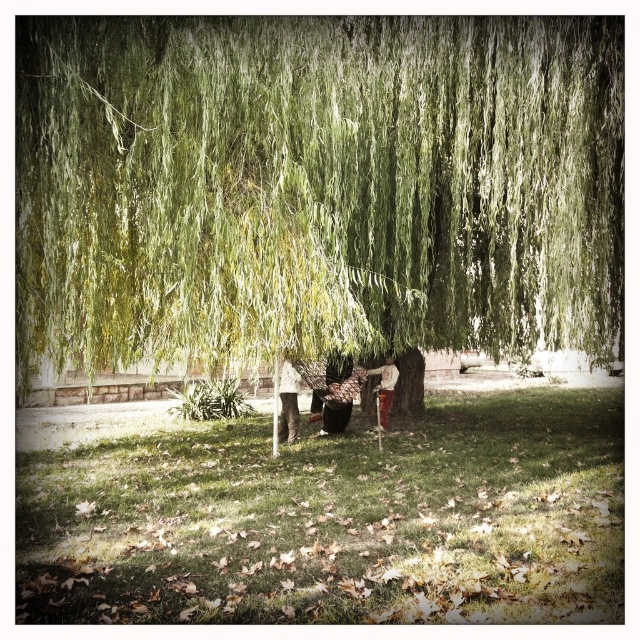
You are planning to set up a picnic blanket in this outdoor area. The picnic blanket is 10 feet long. Considering the space between the green leafy willow at center and the green grass at lower center, will the blanket fit horizontally without overlapping either the willow or the grass?

The distance between the green leafy willow at center and the green grass at lower center is 17.37 feet. Since the picnic blanket is only 10 feet long, it will fit horizontally without overlapping either the willow or the grass.

You are planning to set up a picnic blanket in the area where the green grass at lower center is located. Considering the green leafy willow at center, will the willow provide enough shade to cover the entire picnic blanket?

The green leafy willow at center has a width less than the green grass at lower center, so the willow may not provide enough shade to cover the entire picnic blanket since its width is smaller than the grass area.

You are standing at the camera position and want to take a photo of the green leafy willow at center. If you have a camera with a 50mm lens, which has a field of view of about 46 degrees, will the entire willow fit in the frame?

The green leafy willow at center is 30.64 feet away from the camera. Using the formula for field of view, the maximum width that can be captured is approximately 23.3 feet. Since the willow is wider than this, it will not fit entirely within the frame.